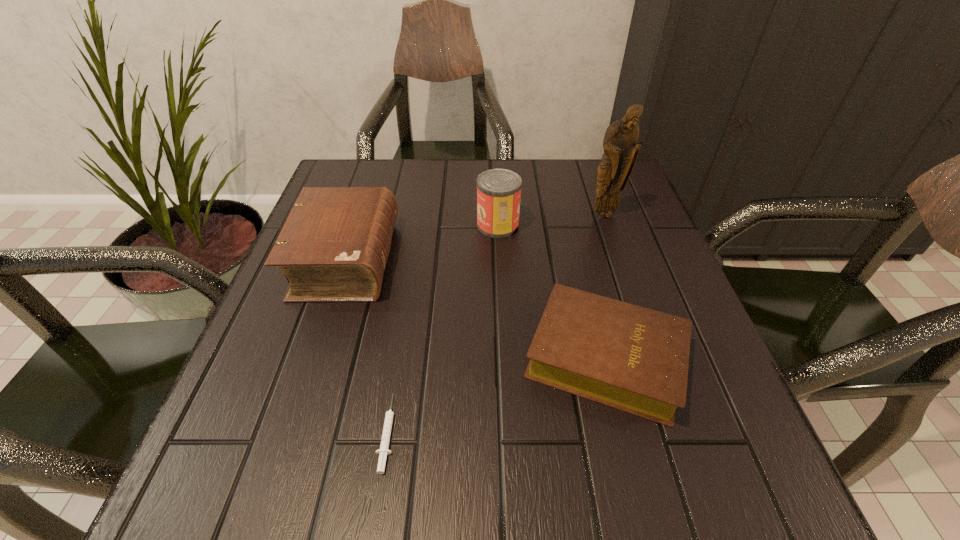
You are a GUI agent. You are given a task and a screenshot of the screen. Output one action in this format:
    pyautogui.click(x=<x>, y=<y>)
    Task: Click on the vacant area that satisfies the following two spatial constraints: 1. on the spine side of the leftmost object; 2. on the back side of the fourth tallest object
    The height and width of the screenshot is (540, 960).
    Given the screenshot: What is the action you would take?
    pyautogui.click(x=314, y=357)

You are a GUI agent. You are given a task and a screenshot of the screen. Output one action in this format:
    pyautogui.click(x=<x>, y=<y>)
    Task: Click on the free space that satisfies the following two spatial constraints: 1. on the spine side of the taller Bible; 2. on the right side of the syringe
    This screenshot has width=960, height=540.
    Given the screenshot: What is the action you would take?
    pyautogui.click(x=289, y=433)